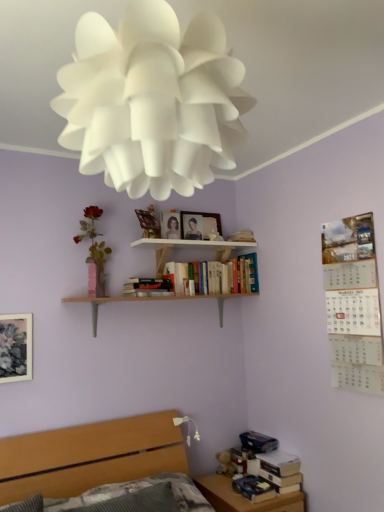
Where is `blank space to the left of hardcover book at lower right, the fifth book viewed from the top`? blank space to the left of hardcover book at lower right, the fifth book viewed from the top is located at coordinates (221, 488).